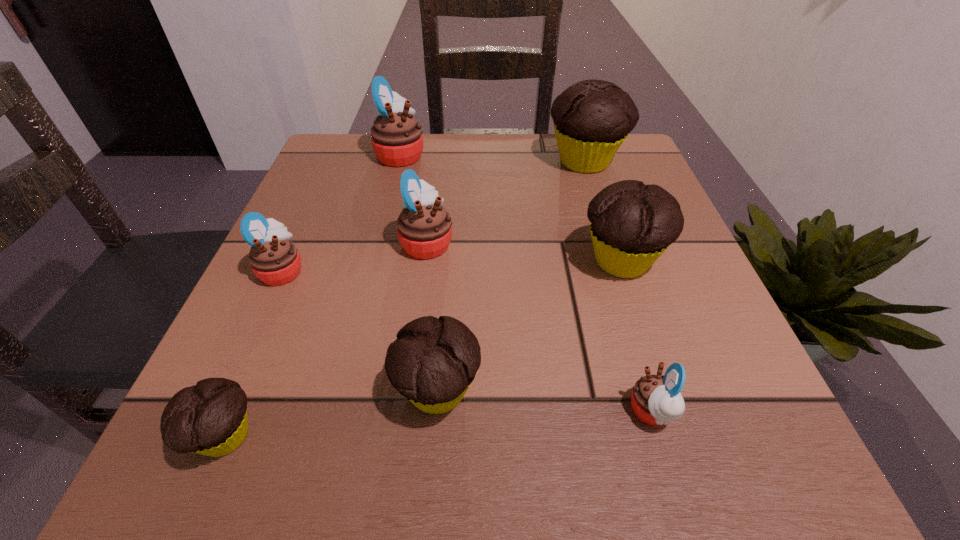
The image size is (960, 540). I want to click on the farthest pink muffin, so click(397, 140).

Find the location of `the biggest chocolate muffin`. the biggest chocolate muffin is located at coordinates (592, 118).

Locate an element on the screen. The height and width of the screenshot is (540, 960). the second biggest pink muffin is located at coordinates (424, 227).

I want to click on the third smallest chocolate muffin, so click(632, 224).

Locate an element on the screen. the leftmost pink muffin is located at coordinates (275, 260).

Find the location of a particular element. This screenshot has height=540, width=960. the second chocolate muffin from left to right is located at coordinates (432, 363).

The image size is (960, 540). In order to click on the smallest pink muffin in this screenshot , I will do `click(656, 400)`.

Identify the location of the nearest pink muffin. The width and height of the screenshot is (960, 540). (656, 400).

Locate an element on the screen. This screenshot has height=540, width=960. the smallest chocolate muffin is located at coordinates (210, 418).

In order to click on free region located on the front-facing side of the farthest pink muffin in this screenshot , I will do `click(533, 154)`.